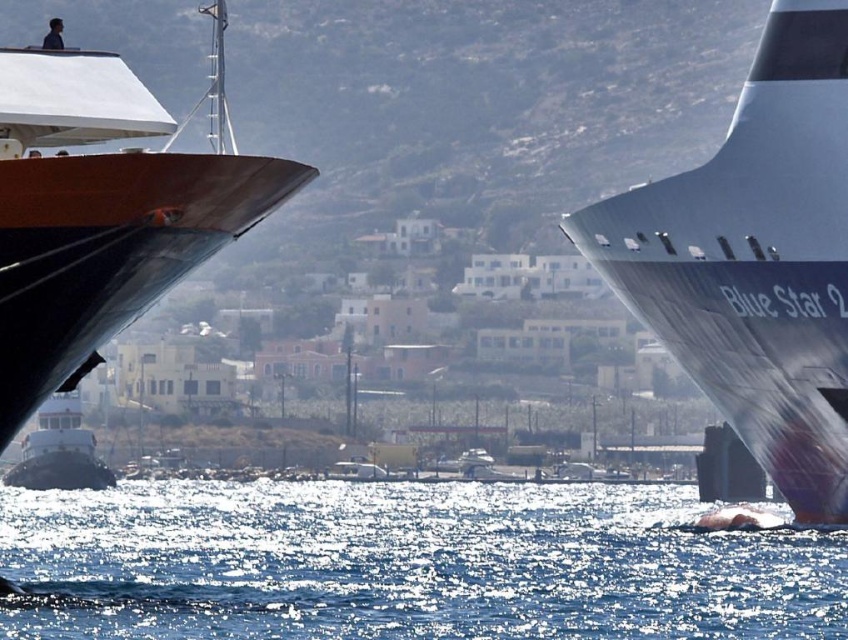
Which is in front, point (776, 4) or point (65, 403)?

Point (776, 4) is in front.

Is metallic gray ship at right positioned behind white glossy tugboat at lower left?

Yes.

Identify the location of metallic gray ship at right. This screenshot has width=848, height=640. (756, 259).

In the scene shown: Who is more forward, [720,403] or [43,236]?

Point [43,236]

Which is behind, point (729, 358) or point (21, 410)?

Positioned behind is point (729, 358).

This screenshot has width=848, height=640. What are the coordinates of `metallic gray ship at right` in the screenshot? It's located at (756, 259).

Between point (54, 605) and point (612, 260), which one is positioned behind?

The point (612, 260) is more distant.

Who is positioned more to the left, blue water at lower center or metallic gray ship at right?

From the viewer's perspective, blue water at lower center appears more on the left side.

Is point (355, 554) farther from camera compared to point (810, 522)?

Yes, point (355, 554) is farther from viewer.

Where is `blue water at lower center`? blue water at lower center is located at coordinates (406, 564).